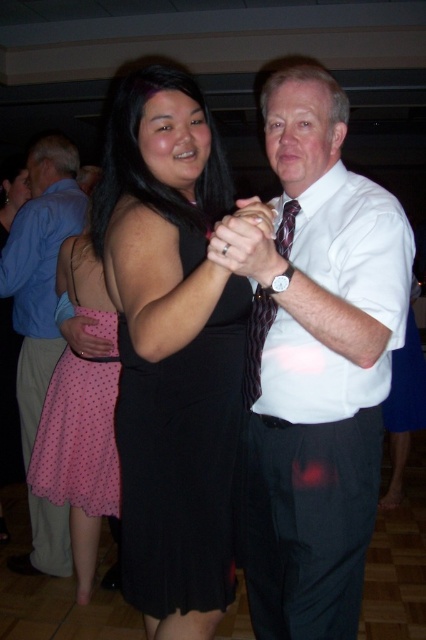
Question: Is black satin dress at center smaller than pink polka dot fabric skirt at left?

Choices:
 (A) no
 (B) yes

Answer: (A)

Question: Is pink polka dot skirt at left above dark maroon textured tie at center?

Choices:
 (A) yes
 (B) no

Answer: (B)

Question: Does pink polka dot skirt at left have a greater width compared to pink polka dot fabric skirt at left?

Choices:
 (A) yes
 (B) no

Answer: (A)

Question: Which point is farther to the camera?

Choices:
 (A) white shirt at center
 (B) pink polka dot skirt at left
 (C) pink polka dot fabric skirt at left
 (D) black satin dress at center

Answer: (B)

Question: Which point is farther to the camera?

Choices:
 (A) (204, 624)
 (B) (325, 272)
 (C) (331, 502)

Answer: (A)

Question: Which is nearer to the pink polka dot skirt at left?

Choices:
 (A) black satin dress at center
 (B) white shirt at center
 (C) dark maroon textured tie at center

Answer: (A)